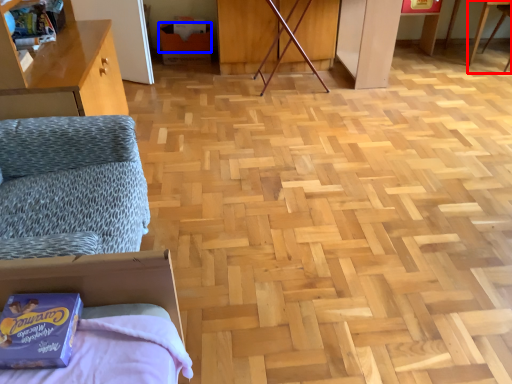
Question: Which object appears closest to the camera in this image, table (highlighted by a red box) or cardboard box (highlighted by a blue box)?

Choices:
 (A) table
 (B) cardboard box

Answer: (A)